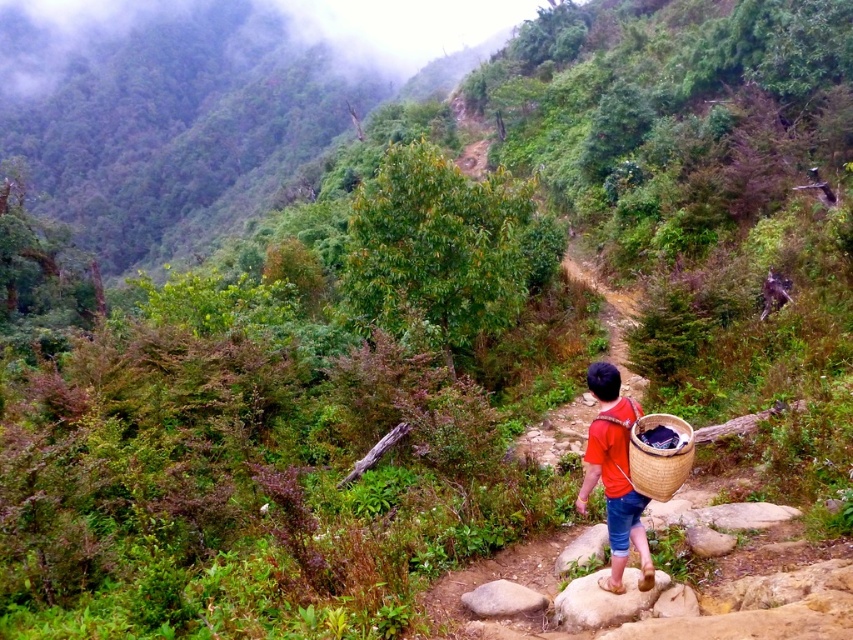
Question: In this image, where is woven bamboo basket at lower right located relative to smooth gray rock at center?

Choices:
 (A) above
 (B) below

Answer: (A)

Question: Observing the image, what is the correct spatial positioning of red woven basket at center in reference to smooth gray rock at center?

Choices:
 (A) left
 (B) right

Answer: (B)

Question: Which object is the closest to the smooth gray rock at center?

Choices:
 (A) woven bamboo basket at lower right
 (B) red woven basket at center

Answer: (B)

Question: Among these points, which one is nearest to the camera?

Choices:
 (A) (520, 588)
 (B) (607, 371)
 (C) (653, 449)

Answer: (C)

Question: Which point appears farthest from the camera in this image?

Choices:
 (A) (648, 580)
 (B) (489, 596)

Answer: (B)

Question: Is red woven basket at center positioned behind smooth gray rock at center?

Choices:
 (A) no
 (B) yes

Answer: (A)